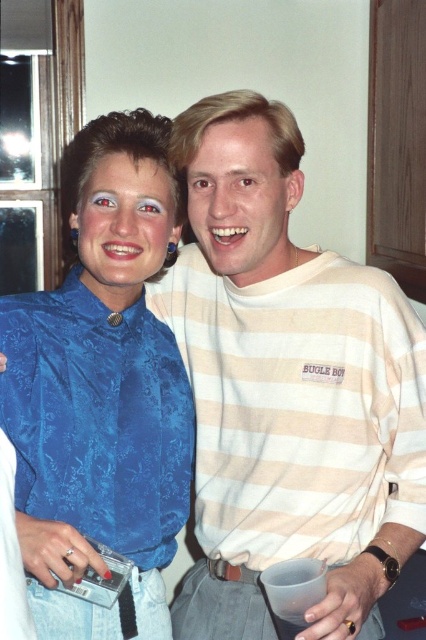
What is the color of the shirt worn by the person at the point with coordinates (241,202)?

The matte beige shirt at center is represented by point (241,202), so the color is beige.

You are standing in front of a group photo and notice two blue blouses. The first is the blue satin blouse at left, and the second is the matte blue blouse at upper left. Which one appears nearer to you?

The blue satin blouse at left appears nearer to you because it is closer to the viewer than the matte blue blouse at upper left.

You are standing in a room and see two people. The first person is wearing a blue satin blouse at left, and the second is wearing a matte beige shirt at center. If you want to greet both of them, which person should you approach first if you are facing the scene?

You should approach the blue satin blouse at left first because it is positioned to the left of the matte beige shirt at center, making it closer to your left side when facing the scene.